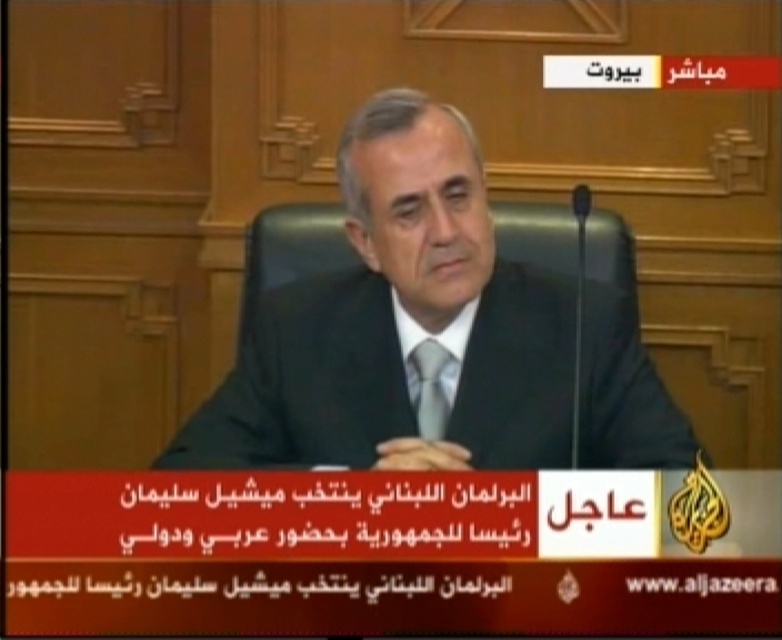
Does black suit at center have a larger size compared to matte gray tie at center?

Yes.

Is black suit at center wider than matte gray tie at center?

Yes, black suit at center is wider than matte gray tie at center.

Who is more forward, (x=529, y=328) or (x=421, y=410)?

Positioned in front is point (x=421, y=410).

Where is `black suit at center`? black suit at center is located at coordinates (400, 324).